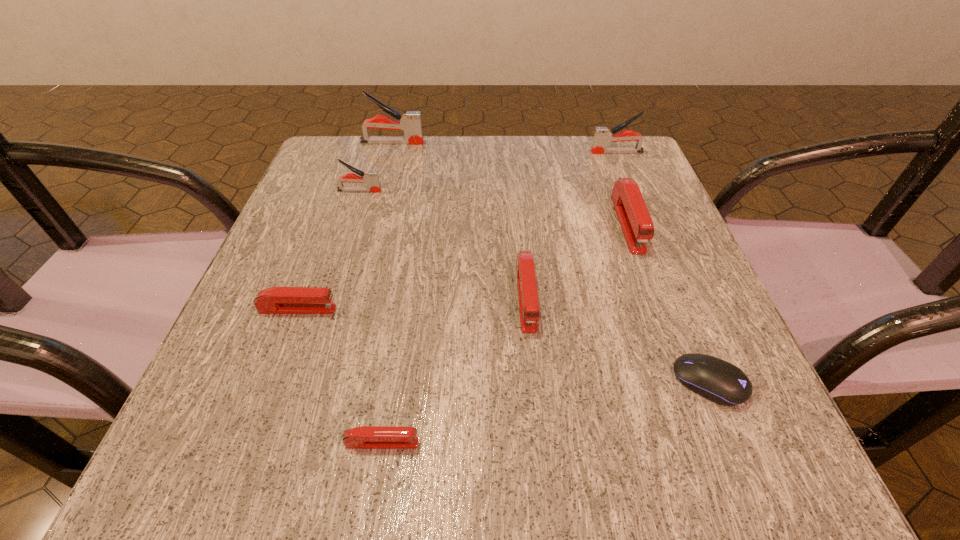
Point out which gray stapler is positioned as the nearest to the third red stapler from left to right. Please provide its 2D coordinates. Your answer should be formatted as a tuple, i.e. [(x, y)], where the tuple contains the x and y coordinates of a point satisfying the conditions above.

[(371, 178)]

Locate an element on the screen. This screenshot has height=540, width=960. red stapler that is the second closest to the third shortest object is located at coordinates [528, 301].

Identify which red stapler is located as the second nearest to the farthest stapler. Please provide its 2D coordinates. Your answer should be formatted as a tuple, i.e. [(x, y)], where the tuple contains the x and y coordinates of a point satisfying the conditions above.

[(528, 301)]

The image size is (960, 540). I want to click on free space that satisfies the following two spatial constraints: 1. on the front-facing side of the fifth tallest stapler; 2. on the front-facing side of the nearest red stapler, so click(x=540, y=443).

Identify the location of blank area in the image that satisfies the following two spatial constraints: 1. on the front-facing side of the biggest red stapler; 2. on the front-facing side of the shortest stapler. (708, 443).

The width and height of the screenshot is (960, 540). Identify the location of vacant space that satisfies the following two spatial constraints: 1. on the front-facing side of the third smallest red stapler; 2. on the front-facing side of the nearest object. (540, 443).